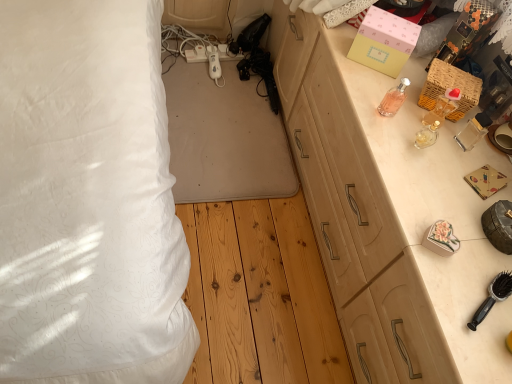
I want to click on free spot to the left of woven wicker basket at upper right, the first box from the right, so click(x=370, y=91).